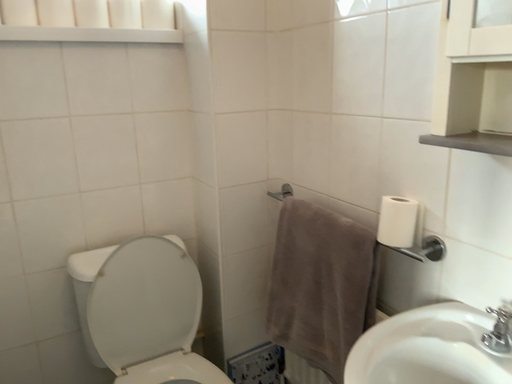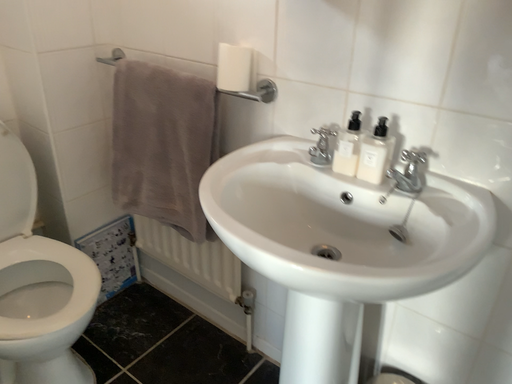
Question: Which way did the camera rotate in the video?

Choices:
 (A) rotated downward
 (B) rotated upward

Answer: (A)